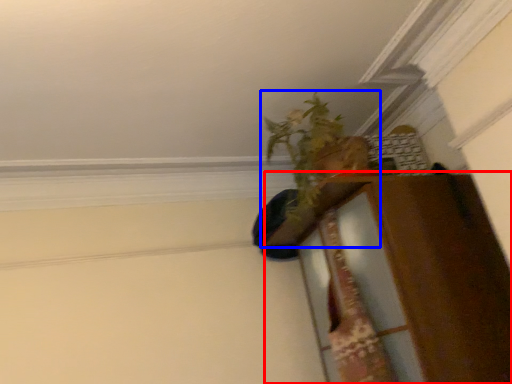
Question: Which of the following is the closest to the observer, dresser (highlighted by a red box) or houseplant (highlighted by a blue box)?

Choices:
 (A) dresser
 (B) houseplant

Answer: (A)